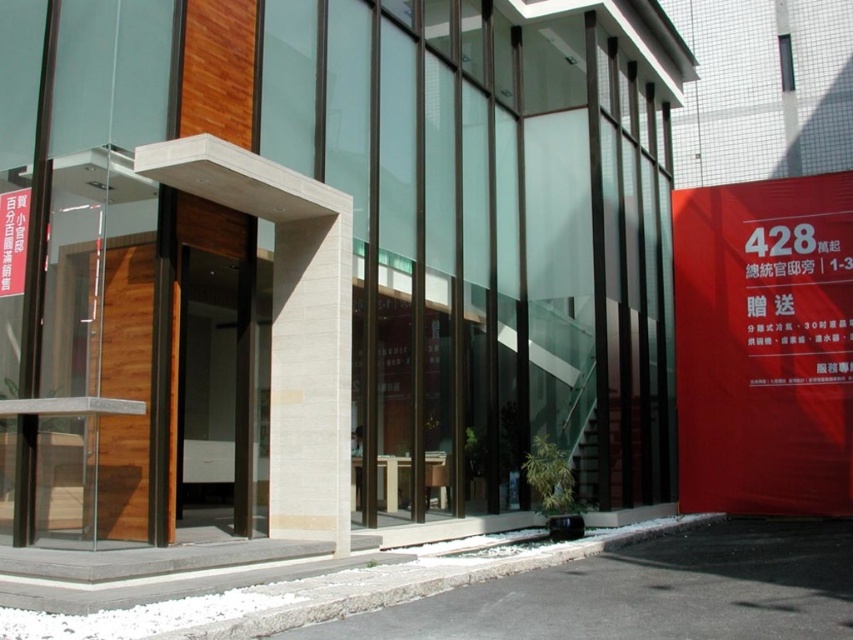
Who is higher up, red matte sign at right or brown wooden door at center?

Positioned higher is red matte sign at right.

In the scene shown: Does red matte sign at right lie behind brown wooden door at center?

Yes, red matte sign at right is further from the viewer.

Describe the element at coordinates (764, 346) in the screenshot. I see `red matte sign at right` at that location.

Where is `red matte sign at right`? red matte sign at right is located at coordinates (764, 346).